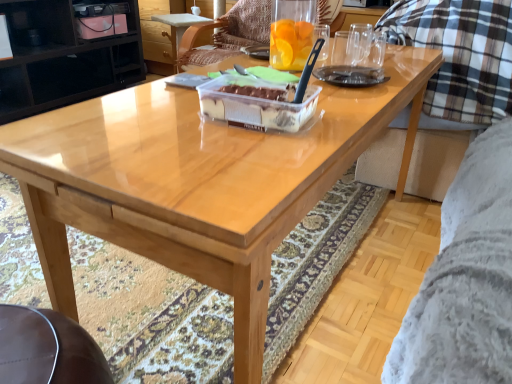
Question: Is point (245, 36) positioned closer to the camera than point (10, 61)?

Choices:
 (A) closer
 (B) farther

Answer: (B)

Question: In the image, is wooden chair at center on the left side or the right side of black glossy cabinet at upper left?

Choices:
 (A) right
 (B) left

Answer: (A)

Question: Which object is positioned closest to the black glossy cabinet at upper left?

Choices:
 (A) translucent plastic cake at center
 (B) wooden chair at center

Answer: (B)

Question: Which object is the farthest from the wooden chair at center?

Choices:
 (A) translucent plastic cake at center
 (B) black glossy cabinet at upper left

Answer: (B)